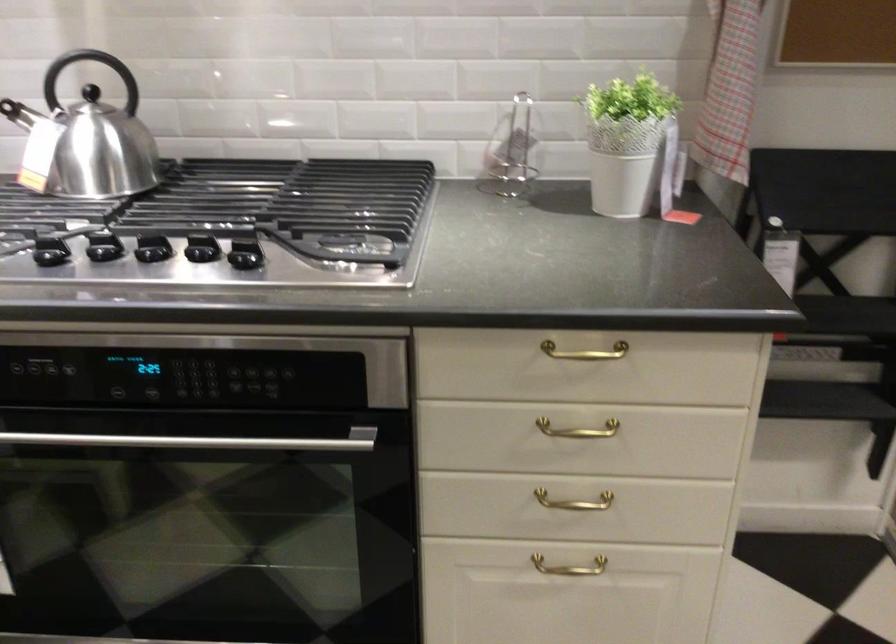
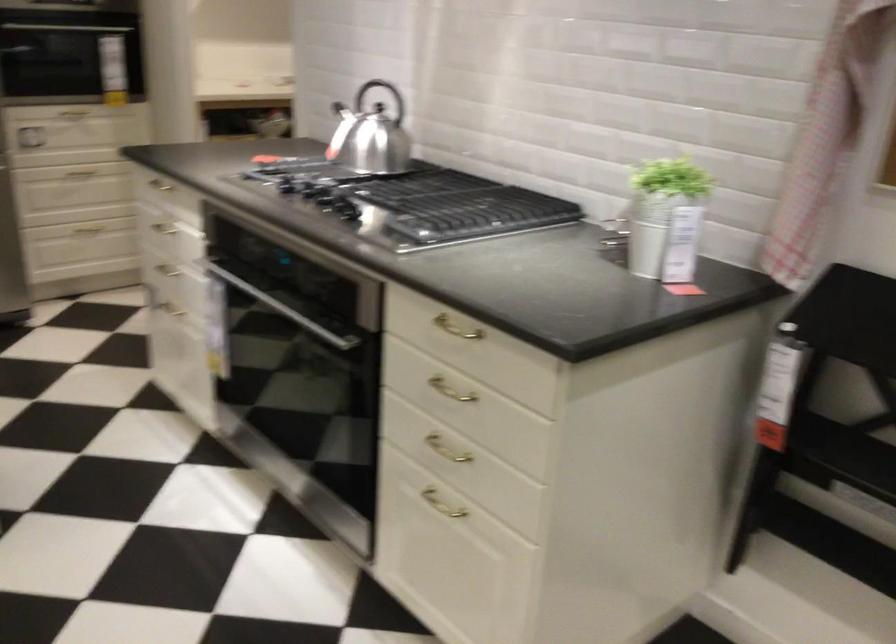
The point at (552, 567) is marked in the first image. Where is the corresponding point in the second image?

(442, 504)